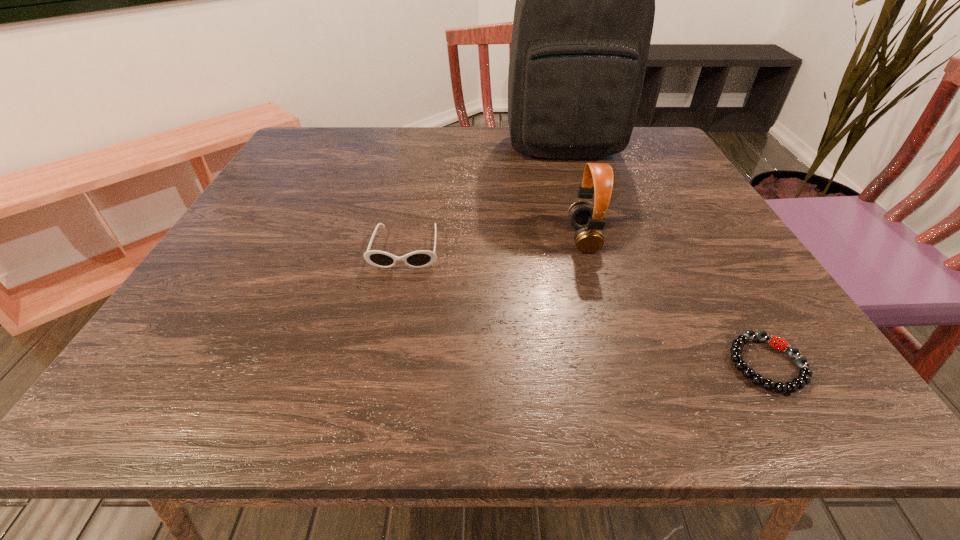
This screenshot has height=540, width=960. In the image, there is a desktop. Identify the location of vacant space at the near edge. (409, 404).

Locate an element on the screen. vacant space at the left edge of the desktop is located at coordinates click(x=321, y=197).

Where is `free space at the right edge of the desktop`? The image size is (960, 540). free space at the right edge of the desktop is located at coordinates click(700, 259).

In the image, there is a desktop. Where is `vacant area at the near left corner`? The width and height of the screenshot is (960, 540). vacant area at the near left corner is located at coordinates (201, 400).

This screenshot has width=960, height=540. Find the location of `vacant point at the far right corner`. vacant point at the far right corner is located at coordinates (643, 135).

Locate an element on the screen. Image resolution: width=960 pixels, height=540 pixels. vacant space that is in between the backpack and the bracelet is located at coordinates (664, 255).

Locate an element on the screen. The height and width of the screenshot is (540, 960). free spot between the backpack and the second shortest object is located at coordinates (484, 197).

The image size is (960, 540). I want to click on vacant space that's between the third shortest object and the shortest object, so click(x=675, y=301).

Identify the location of free space that is in between the third tallest object and the headset. (494, 243).

I want to click on vacant space that is in between the sunglasses and the backpack, so click(484, 197).